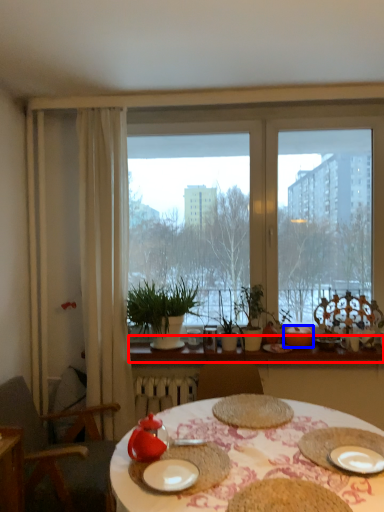
Question: Which point is further to the camera, window sill (highlighted by a red box) or tableware (highlighted by a blue box)?

Choices:
 (A) window sill
 (B) tableware

Answer: (B)